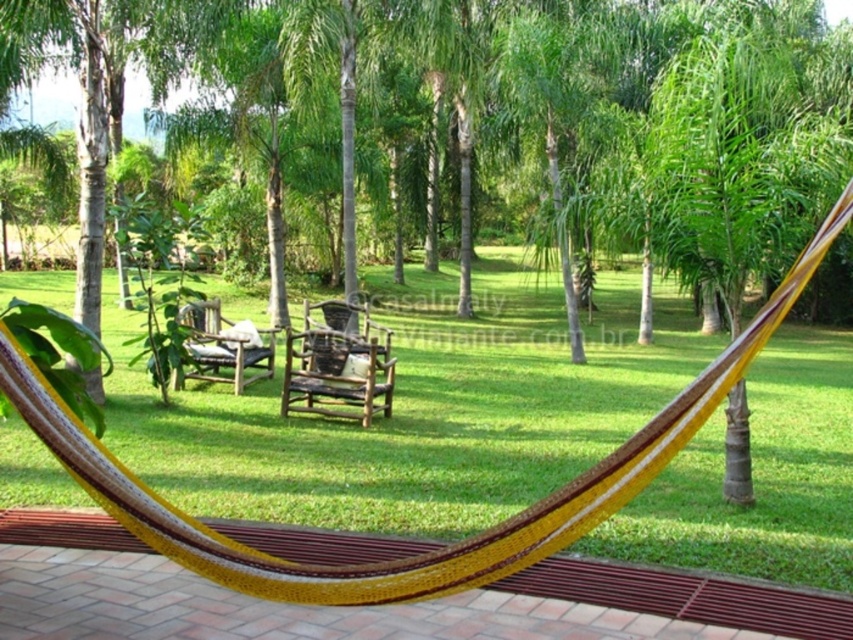
Question: Can you confirm if brown woven park bench at center is thinner than wooden park bench at center?

Choices:
 (A) yes
 (B) no

Answer: (B)

Question: Is brown woven park bench at center above wooden park bench at center?

Choices:
 (A) no
 (B) yes

Answer: (A)

Question: Among these objects, which one is nearest to the camera?

Choices:
 (A) brown woven park bench at center
 (B) wooden park bench at center

Answer: (A)

Question: Which of the following is the closest to the observer?

Choices:
 (A) (375, 364)
 (B) (192, 308)

Answer: (A)

Question: Observing the image, what is the correct spatial positioning of brown woven park bench at center in reference to wooden park bench at center?

Choices:
 (A) below
 (B) above

Answer: (A)

Question: Among these points, which one is nearest to the camera?

Choices:
 (A) (239, 369)
 (B) (310, 381)

Answer: (B)